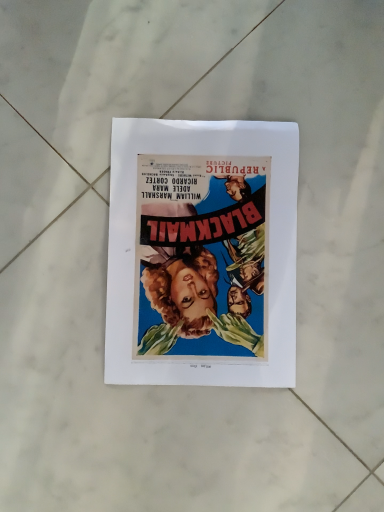
Question: Should I look upward or downward to see matte paper poster at center?

Choices:
 (A) up
 (B) down

Answer: (A)